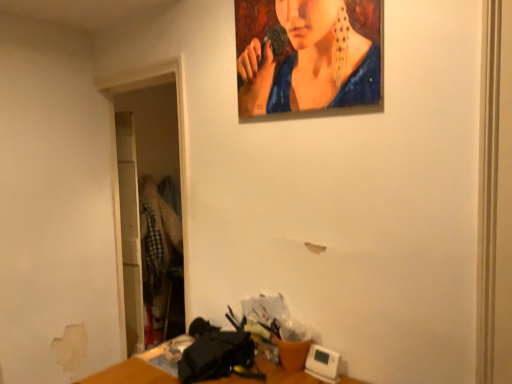
Question: From the image's perspective, relative to wooden table at lower center, is oil painting portrait at upper center above or below?

Choices:
 (A) below
 (B) above

Answer: (B)

Question: Is point (381, 34) positioned closer to the camera than point (110, 377)?

Choices:
 (A) closer
 (B) farther

Answer: (A)

Question: In terms of width, does oil painting portrait at upper center look wider or thinner when compared to wooden table at lower center?

Choices:
 (A) wide
 (B) thin

Answer: (B)

Question: Relative to oil painting portrait at upper center, is wooden table at lower center in front or behind?

Choices:
 (A) front
 (B) behind

Answer: (A)

Question: In the image, is wooden table at lower center on the left side or the right side of oil painting portrait at upper center?

Choices:
 (A) right
 (B) left

Answer: (B)

Question: In terms of height, does wooden table at lower center look taller or shorter compared to oil painting portrait at upper center?

Choices:
 (A) tall
 (B) short

Answer: (B)

Question: Looking at their shapes, would you say wooden table at lower center is wider or thinner than oil painting portrait at upper center?

Choices:
 (A) thin
 (B) wide

Answer: (B)